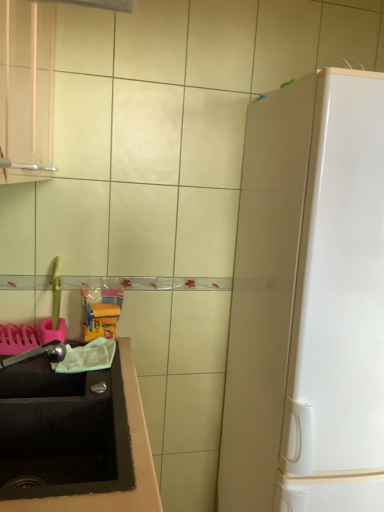
Question: Considering the positions of satin nickel faucet at lower left and white glossy refrigerator at right in the image, is satin nickel faucet at lower left taller or shorter than white glossy refrigerator at right?

Choices:
 (A) short
 (B) tall

Answer: (A)

Question: Considering the positions of satin nickel faucet at lower left and white glossy refrigerator at right in the image, is satin nickel faucet at lower left bigger or smaller than white glossy refrigerator at right?

Choices:
 (A) big
 (B) small

Answer: (B)

Question: Estimate the real-world distances between objects in this image. Which object is closer to the black matte sink at lower left?

Choices:
 (A) satin nickel faucet at lower left
 (B) white glossy refrigerator at right

Answer: (A)

Question: Estimate the real-world distances between objects in this image. Which object is farther from the satin nickel faucet at lower left?

Choices:
 (A) white glossy refrigerator at right
 (B) black matte sink at lower left

Answer: (A)